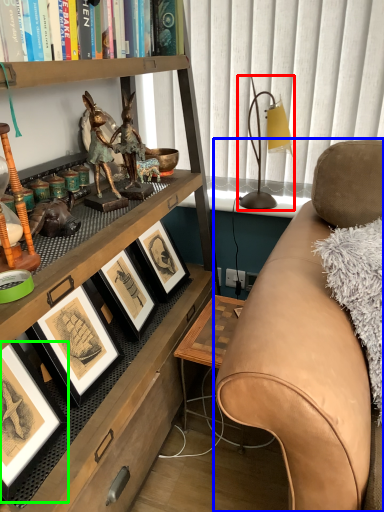
Question: Which object is positioned farthest from table lamp (highlighted by a red box)? Select from studio couch (highlighted by a blue box) and picture frame (highlighted by a green box).

Choices:
 (A) studio couch
 (B) picture frame

Answer: (B)